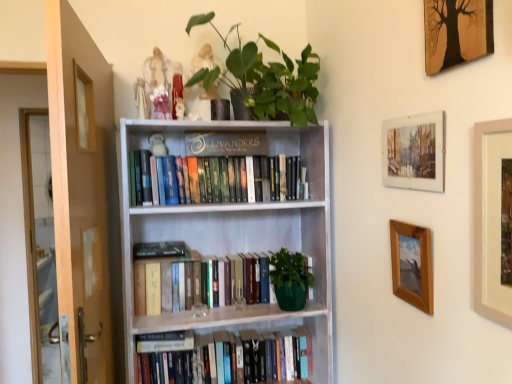
Question: Is wooden picture frame at right, which ranks as the 1th picture frame in bottom-to-top order, not inside green matte plant at upper center?

Choices:
 (A) no
 (B) yes

Answer: (B)

Question: Does wooden picture frame at right, which ranks as the 1th picture frame in bottom-to-top order, have a greater width compared to green matte plant at upper center?

Choices:
 (A) no
 (B) yes

Answer: (A)

Question: Considering the relative sizes of wooden picture frame at right, which is the fourth picture frame in top-to-bottom order, and green matte plant at upper center in the image provided, is wooden picture frame at right, which is the fourth picture frame in top-to-bottom order, smaller than green matte plant at upper center?

Choices:
 (A) no
 (B) yes

Answer: (B)

Question: Is wooden picture frame at right, which is the fourth picture frame in top-to-bottom order, to the left of green matte plant at upper center from the viewer's perspective?

Choices:
 (A) yes
 (B) no

Answer: (B)

Question: Can you confirm if wooden picture frame at right, which is the fourth picture frame in top-to-bottom order, is thinner than green matte plant at upper center?

Choices:
 (A) yes
 (B) no

Answer: (A)

Question: Considering the relative positions of wooden picture frame at right, which is the fourth picture frame in top-to-bottom order, and green matte plant at upper center in the image provided, is wooden picture frame at right, which is the fourth picture frame in top-to-bottom order, behind green matte plant at upper center?

Choices:
 (A) yes
 (B) no

Answer: (B)

Question: Considering the relative sizes of wooden picture frame at right, which is the fourth picture frame in top-to-bottom order, and wooden framed tree art at upper right, marked as the 1th picture frame in a top-to-bottom arrangement, in the image provided, is wooden picture frame at right, which is the fourth picture frame in top-to-bottom order, thinner than wooden framed tree art at upper right, marked as the 1th picture frame in a top-to-bottom arrangement,?

Choices:
 (A) no
 (B) yes

Answer: (A)

Question: Is wooden picture frame at right, which ranks as the 1th picture frame in bottom-to-top order, further to camera compared to wooden framed tree art at upper right, marked as the 1th picture frame in a top-to-bottom arrangement?

Choices:
 (A) yes
 (B) no

Answer: (A)

Question: From the image's perspective, is wooden picture frame at right, which ranks as the 1th picture frame in bottom-to-top order, on wooden framed tree art at upper right, which is counted as the 4th picture frame, starting from the bottom?

Choices:
 (A) no
 (B) yes

Answer: (A)

Question: Is wooden picture frame at right, which ranks as the 1th picture frame in bottom-to-top order, smaller than wooden framed tree art at upper right, which is counted as the 4th picture frame, starting from the bottom?

Choices:
 (A) yes
 (B) no

Answer: (A)

Question: Does wooden picture frame at right, which is the fourth picture frame in top-to-bottom order, turn towards wooden framed tree art at upper right, marked as the 1th picture frame in a top-to-bottom arrangement?

Choices:
 (A) yes
 (B) no

Answer: (B)

Question: Is wooden picture frame at right, which ranks as the 1th picture frame in bottom-to-top order, to the right of wooden framed tree art at upper right, which is counted as the 4th picture frame, starting from the bottom, from the viewer's perspective?

Choices:
 (A) no
 (B) yes

Answer: (A)

Question: Is hardcover books at center, the 2th book when ordered from top to bottom, closer to the viewer compared to hardcover books at center, which appears as the 1th book when ordered from the bottom?

Choices:
 (A) no
 (B) yes

Answer: (B)